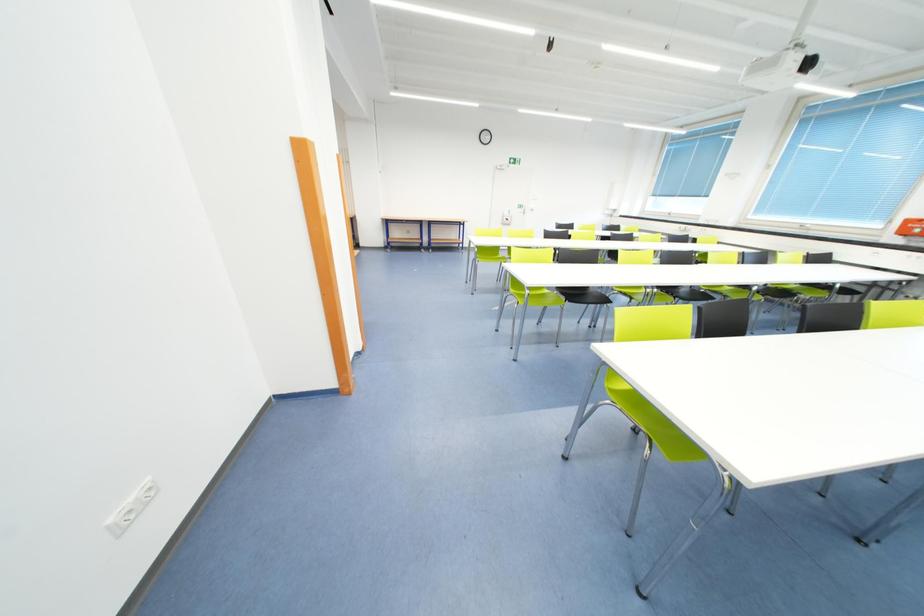
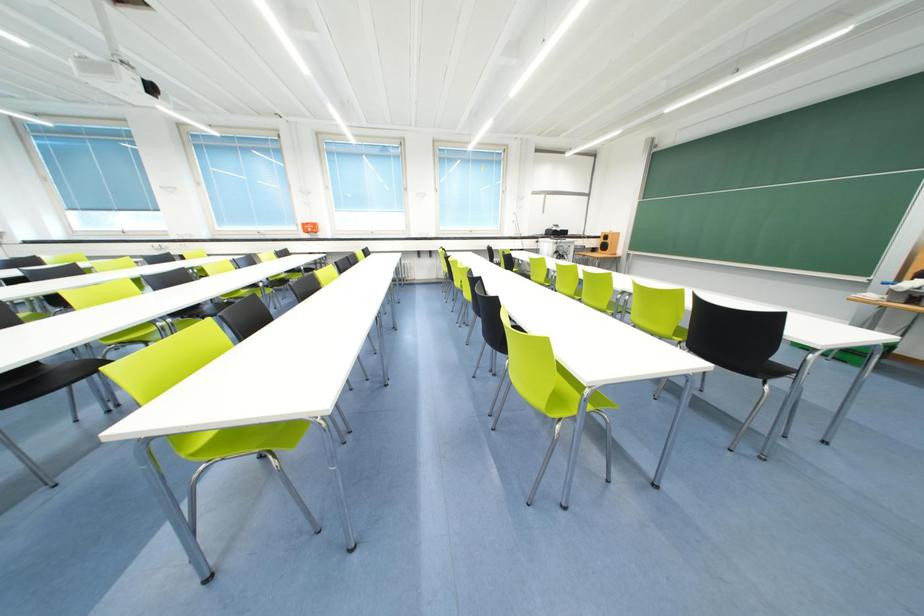
How did the camera likely rotate?

The camera's rotation is toward right-down.